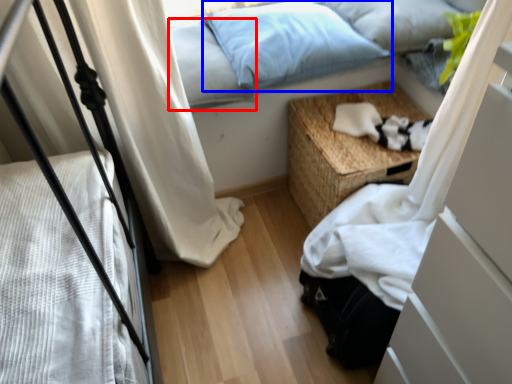
Question: Which object appears closest to the camera in this image, pillow (highlighted by a red box) or pillow (highlighted by a blue box)?

Choices:
 (A) pillow
 (B) pillow

Answer: (A)